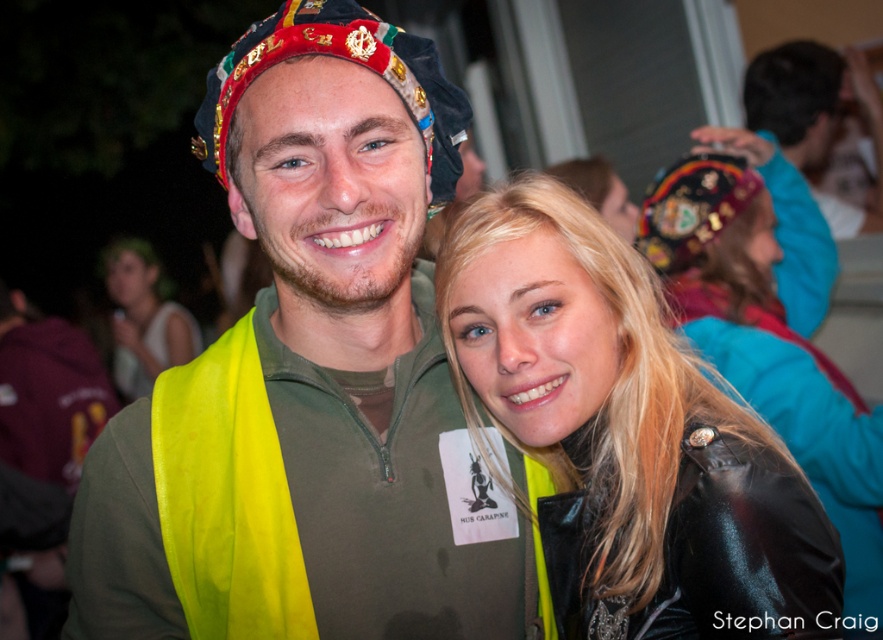
Question: Can you confirm if shiny black leather jacket at center is thinner than matte black hat at upper right?

Choices:
 (A) yes
 (B) no

Answer: (B)

Question: Which is farther from the neon yellow fabric safety vest at center?

Choices:
 (A) matte yellow vest at center
 (B) matte green vest at center
 (C) black leather jacket at upper right

Answer: (A)

Question: Does matte green vest at center appear on the left side of matte yellow vest at center?

Choices:
 (A) yes
 (B) no

Answer: (B)

Question: Which point is closer to the camera?

Choices:
 (A) (246, 314)
 (B) (798, 86)
 (C) (565, 314)
 (D) (123, 310)

Answer: (C)

Question: Does black leather jacket at upper right have a larger size compared to matte yellow vest at center?

Choices:
 (A) yes
 (B) no

Answer: (B)

Question: Which point appears farthest from the camera in this image?

Choices:
 (A) (870, 461)
 (B) (495, 250)
 (C) (92, 451)
 (D) (127, 282)

Answer: (D)